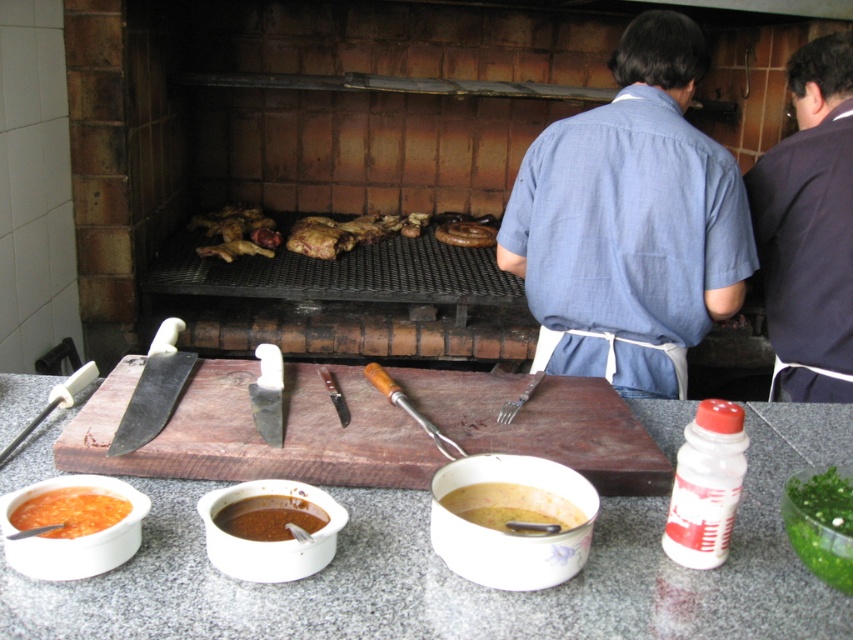
Can you confirm if blue cotton shirt at center is bigger than dark blue shirt at upper right?

Indeed, blue cotton shirt at center has a larger size compared to dark blue shirt at upper right.

Looking at this image, does blue cotton shirt at center appear on the right side of dark blue shirt at upper right?

Incorrect, blue cotton shirt at center is not on the right side of dark blue shirt at upper right.

Who is more forward, (728, 234) or (817, 323)?

Point (728, 234)

The image size is (853, 640). In order to click on blue cotton shirt at center in this screenshot , I will do `click(630, 221)`.

You are a GUI agent. You are given a task and a screenshot of the screen. Output one action in this format:
    pyautogui.click(x=<x>, y=<y>)
    Task: Click on the brown wood cutting board at center
    Image resolution: width=853 pixels, height=640 pixels.
    Given the screenshot: What is the action you would take?
    pyautogui.click(x=254, y=429)

The width and height of the screenshot is (853, 640). I want to click on brown wood cutting board at center, so click(254, 429).

Is dark blue shirt at upper right thinner than green leafy vegetable at lower right?

Incorrect, dark blue shirt at upper right's width is not less than green leafy vegetable at lower right's.

This screenshot has width=853, height=640. Find the location of `dark blue shirt at upper right`. dark blue shirt at upper right is located at coordinates (809, 227).